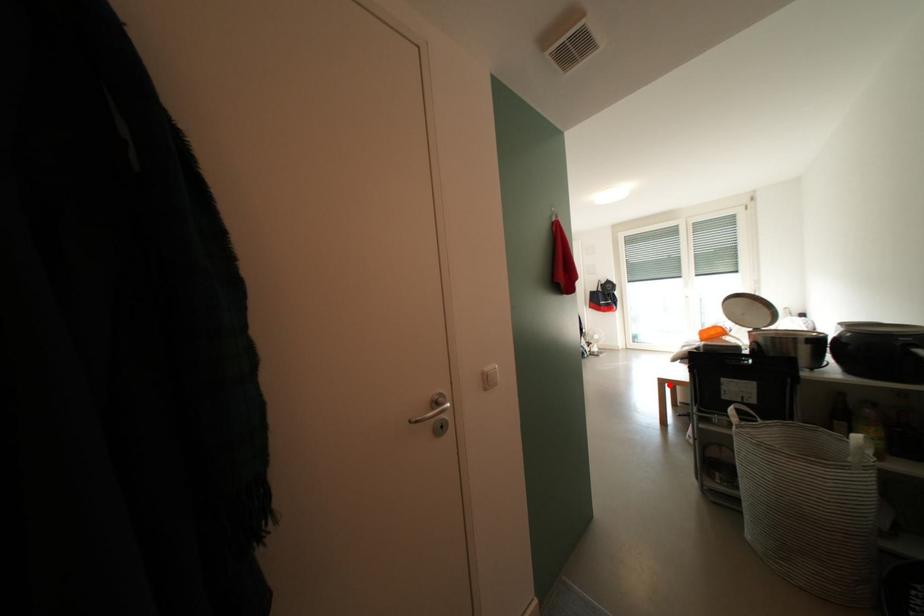
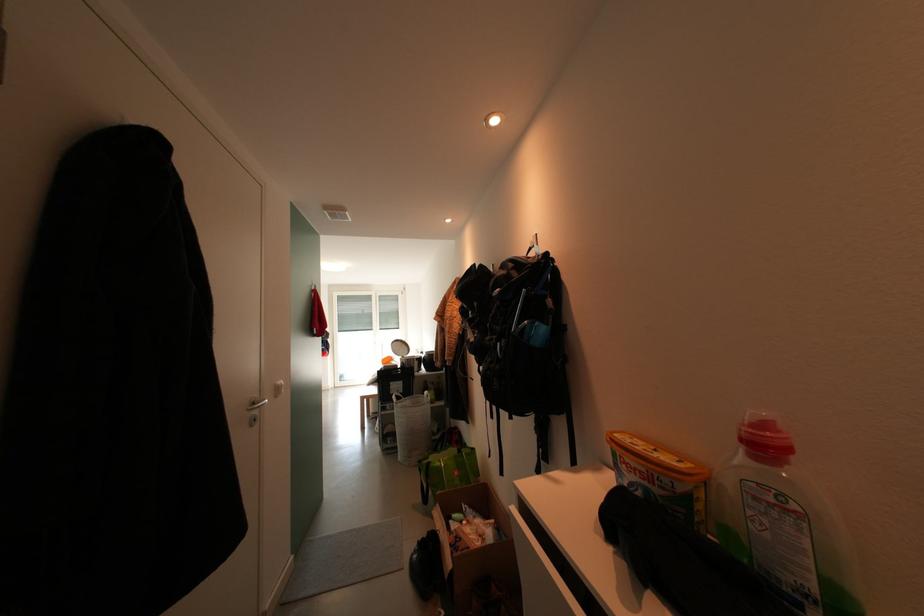
Question: I am providing you with two images of the same scene from different viewpoints. A red point is marked on the first image. Can you still see the location of the red point in image 2?

Choices:
 (A) Yes
 (B) No

Answer: (A)